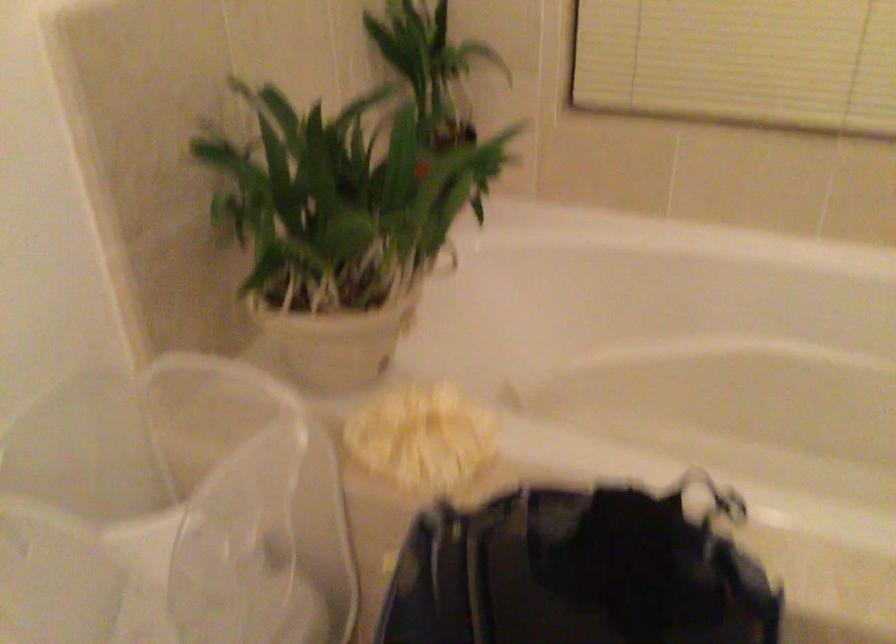
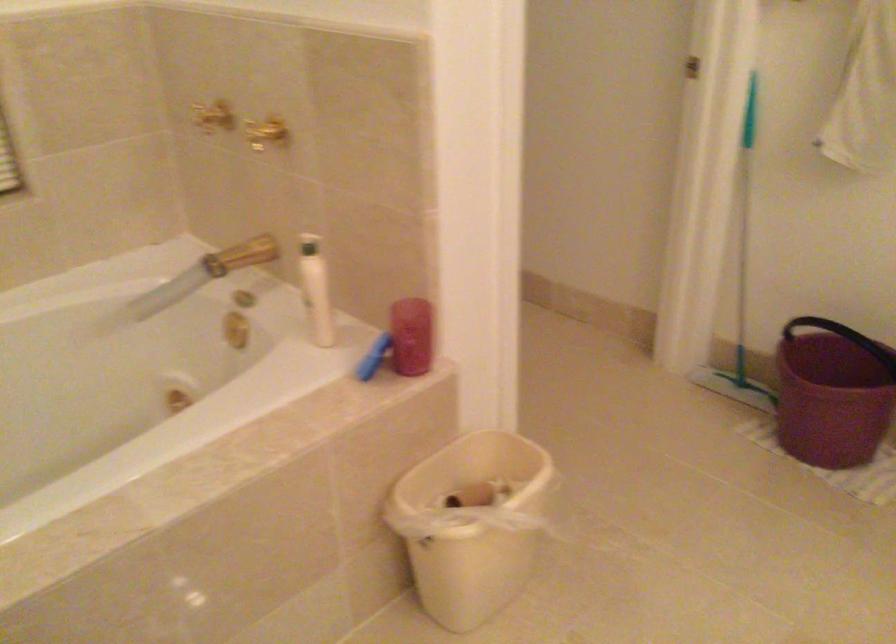
Question: The camera is either moving clockwise (left) or counter-clockwise (right) around the object. The first image is from the beginning of the video and the second image is from the end. Is the camera moving left or right when shooting the video?

Choices:
 (A) Left
 (B) Right

Answer: (A)